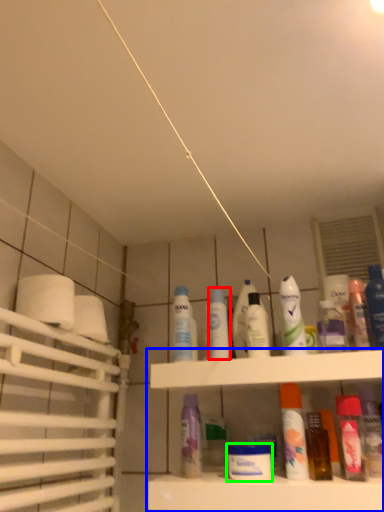
Question: Estimate the real-world distances between objects in this image. Which object is closer to mouthwash (highlighted by a red box), shelf (highlighted by a blue box) or mouthwash (highlighted by a green box)?

Choices:
 (A) shelf
 (B) mouthwash

Answer: (A)